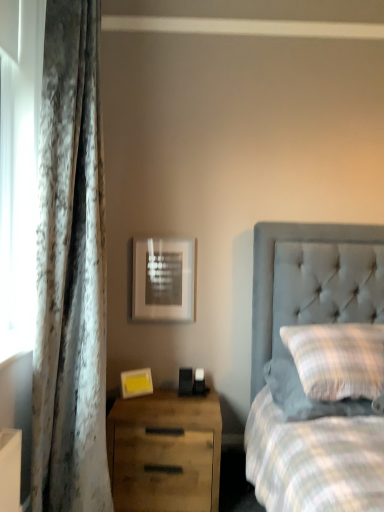
Question: Can you confirm if velvet curtain at left is thinner than yellow matte picture frame at lower left, acting as the second picture frame starting from the back?

Choices:
 (A) yes
 (B) no

Answer: (B)

Question: Is the position of velvet curtain at left less distant than that of yellow matte picture frame at lower left, acting as the first picture frame starting from the bottom?

Choices:
 (A) yes
 (B) no

Answer: (A)

Question: Does velvet curtain at left appear on the right side of yellow matte picture frame at lower left, arranged as the 1th picture frame when viewed from the front?

Choices:
 (A) no
 (B) yes

Answer: (A)

Question: From the image's perspective, would you say velvet curtain at left is shown under yellow matte picture frame at lower left, arranged as the 1th picture frame when viewed from the front?

Choices:
 (A) no
 (B) yes

Answer: (A)

Question: From a real-world perspective, is velvet curtain at left over yellow matte picture frame at lower left, acting as the second picture frame starting from the back?

Choices:
 (A) no
 (B) yes

Answer: (B)

Question: Does velvet curtain at left contain yellow matte picture frame at lower left, acting as the second picture frame starting from the back?

Choices:
 (A) no
 (B) yes

Answer: (A)

Question: Is velvet curtain at left closer to the viewer compared to matte silver picture frame at upper center, which ranks as the 2th picture frame in front-to-back order?

Choices:
 (A) yes
 (B) no

Answer: (A)

Question: Is velvet curtain at left oriented away from matte silver picture frame at upper center, which appears as the 2th picture frame when ordered from the bottom?

Choices:
 (A) yes
 (B) no

Answer: (B)

Question: From the image's perspective, is velvet curtain at left located beneath matte silver picture frame at upper center, the 1th picture frame in the back-to-front sequence?

Choices:
 (A) yes
 (B) no

Answer: (B)

Question: Is velvet curtain at left behind matte silver picture frame at upper center, the 1th picture frame in the back-to-front sequence?

Choices:
 (A) yes
 (B) no

Answer: (B)

Question: Can you confirm if velvet curtain at left is taller than matte silver picture frame at upper center, the 1th picture frame in the back-to-front sequence?

Choices:
 (A) no
 (B) yes

Answer: (B)

Question: Is velvet curtain at left facing towards matte silver picture frame at upper center, which appears as the 2th picture frame when ordered from the bottom?

Choices:
 (A) no
 (B) yes

Answer: (A)

Question: Is matte silver picture frame at upper center, the 1th picture frame when ordered from top to bottom, taller than wooden drawer at lower left?

Choices:
 (A) yes
 (B) no

Answer: (B)